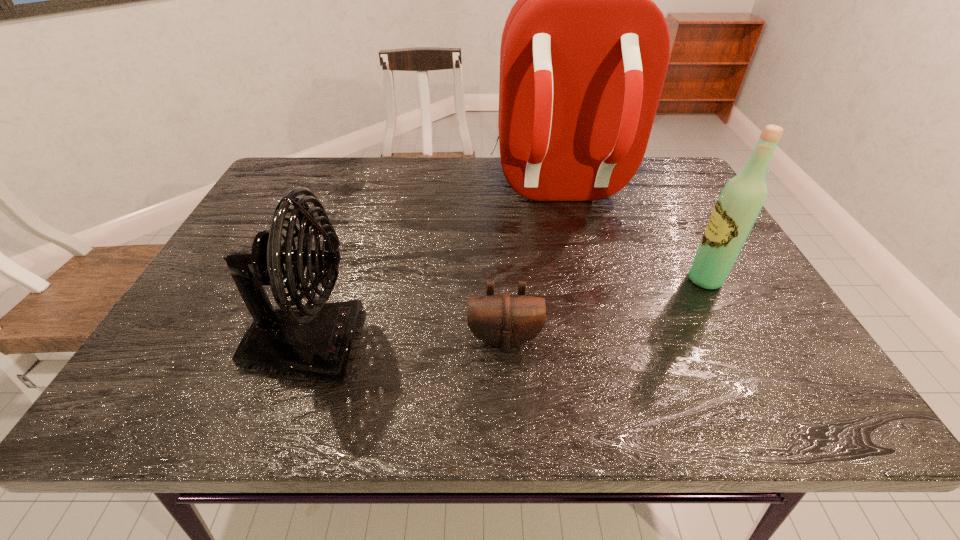
This screenshot has height=540, width=960. Identify the location of vacant space located 0.330m in front of the fan to blow air. (526, 344).

Image resolution: width=960 pixels, height=540 pixels. I want to click on vacant position located 0.110m with the flap open on the pouch, so click(508, 403).

Where is `object situated at the far edge`? This screenshot has height=540, width=960. object situated at the far edge is located at coordinates (584, 54).

This screenshot has height=540, width=960. Identify the location of object located at the near edge. (315, 341).

Where is `object present at the right edge`? The width and height of the screenshot is (960, 540). object present at the right edge is located at coordinates 742,198.

Where is `vacant point at the far edge`? The image size is (960, 540). vacant point at the far edge is located at coordinates (506, 179).

I want to click on free space at the near edge, so click(x=223, y=414).

In the image, there is a desktop. Identify the location of vacant space at the left edge. (171, 338).

Where is `vacant region at the right edge of the desktop`? This screenshot has height=540, width=960. vacant region at the right edge of the desktop is located at coordinates (730, 368).

In the image, there is a desktop. Find the location of `free space at the far right corner`. free space at the far right corner is located at coordinates (690, 182).